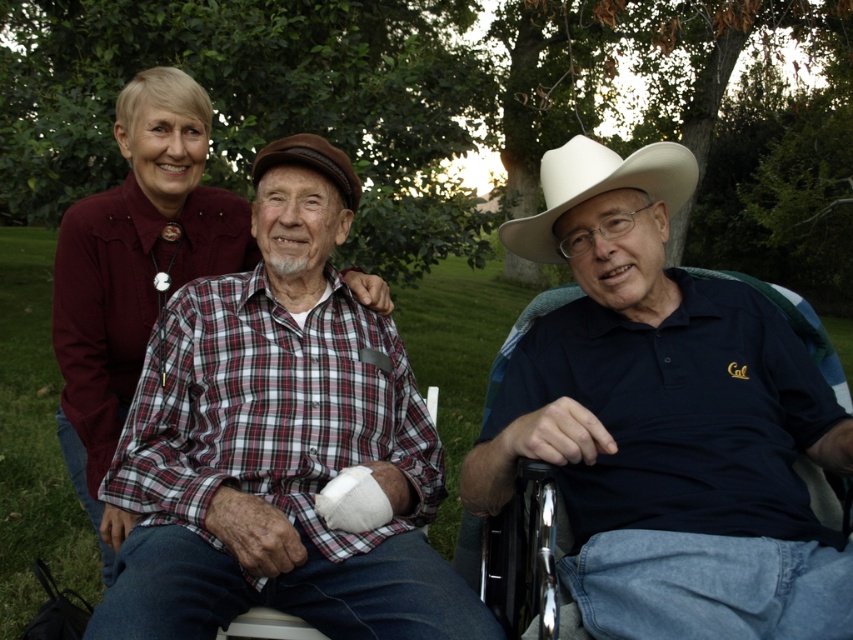
Question: Is the position of white matte cowboy hat at upper center less distant than that of plaid cotton shirt at center?

Choices:
 (A) yes
 (B) no

Answer: (A)

Question: Which object is closer to the camera taking this photo?

Choices:
 (A) white matte cowboy hat at upper center
 (B) plaid cotton shirt at center

Answer: (A)

Question: Does white matte cowboy hat at upper center have a lesser width compared to plaid cotton shirt at center?

Choices:
 (A) no
 (B) yes

Answer: (A)

Question: Is white matte cowboy hat at upper center positioned before white felt cowboy hat at center?

Choices:
 (A) yes
 (B) no

Answer: (A)

Question: Which object is the farthest from the white matte cowboy hat at upper center?

Choices:
 (A) plaid cotton shirt at center
 (B) white felt cowboy hat at center

Answer: (A)

Question: Among these objects, which one is nearest to the camera?

Choices:
 (A) plaid cotton shirt at center
 (B) white matte cowboy hat at upper center
 (C) white felt cowboy hat at center

Answer: (B)